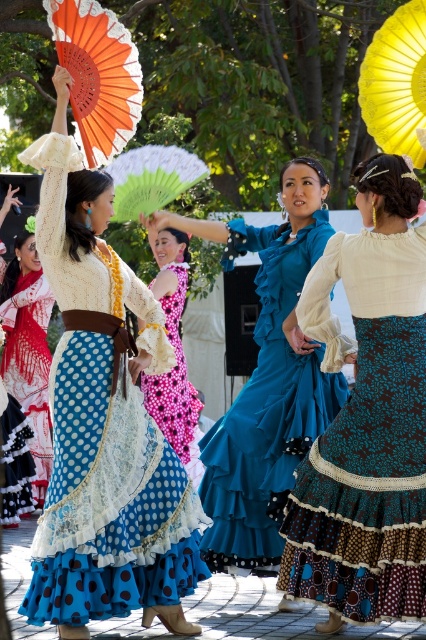
Question: Which point is closer to the camera?

Choices:
 (A) yellow fabric umbrella at upper right
 (B) orange paper fan at upper left

Answer: (A)

Question: Which of the following is the farthest from the observer?

Choices:
 (A) (184, 156)
 (B) (400, 88)
 (C) (83, 188)

Answer: (A)

Question: Which of the following is the farthest from the observer?

Choices:
 (A) (23, 390)
 (B) (368, 90)
 (C) (345, 392)
 (D) (425, 547)

Answer: (A)

Question: Considering the relative positions of teal satin dress at center and orange paper fan at upper left in the image provided, where is teal satin dress at center located with respect to orange paper fan at upper left?

Choices:
 (A) below
 (B) above

Answer: (A)

Question: Does matte white lace dress at center appear over polka dot lace dress at center?

Choices:
 (A) no
 (B) yes

Answer: (B)

Question: Does polka dot lace dress at center have a greater width compared to green fabric fan at center?

Choices:
 (A) no
 (B) yes

Answer: (A)